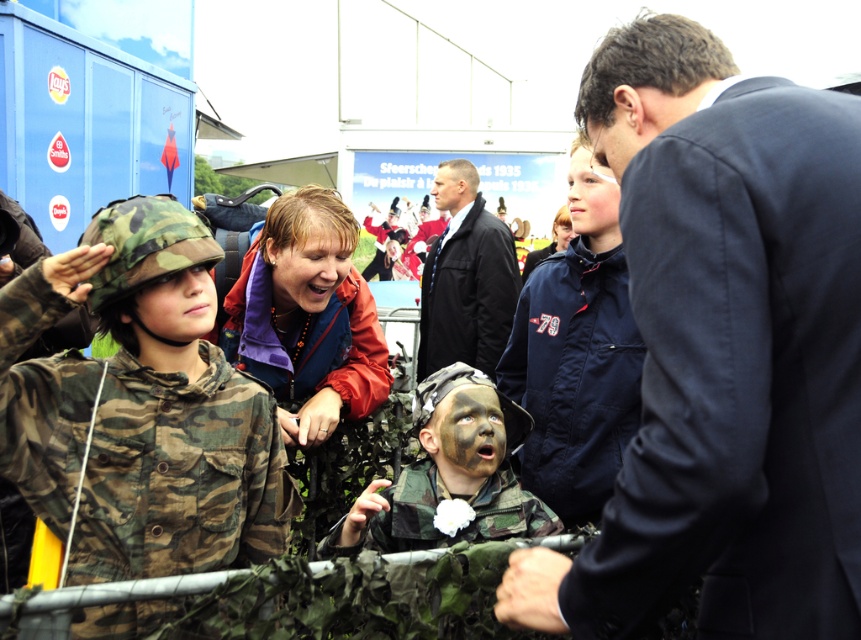
Question: Is smooth skin face at center below matte skin face at center?

Choices:
 (A) no
 (B) yes

Answer: (B)

Question: Which point is closer to the camera?

Choices:
 (A) matte orange jacket at center
 (B) dark blue suit at center
 (C) camouflage fabric at center
 (D) smooth skin face at upper right

Answer: (B)

Question: Can you confirm if camouflage paint face at center is smaller than matte orange jacket at center?

Choices:
 (A) no
 (B) yes

Answer: (B)

Question: Which of these objects is positioned farthest from the smooth skin face at upper right?

Choices:
 (A) matte black face at center
 (B) camouflage paint face at center

Answer: (A)

Question: Which object is positioned closest to the matte orange jacket at center?

Choices:
 (A) matte black face at center
 (B) camouflage fabric face at upper left
 (C) camouflage fabric at center

Answer: (B)

Question: Is navy blue fabric jacket at center positioned behind smooth skin face at upper right?

Choices:
 (A) no
 (B) yes

Answer: (A)